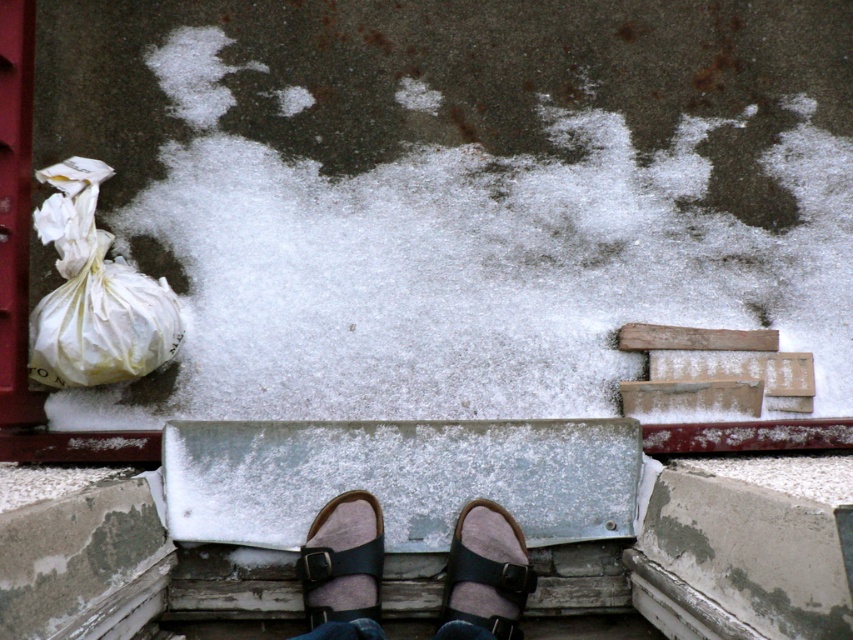
You are standing in the snowy scene and want to place a small object exactly halfway between the two points labeled point [500,586] and point [500,561]. Considering their positions, where would this midpoint be located relative to the viewer?

The midpoint between point [500,586] and point [500,561] would be closer to the viewer than point [500,561] but farther than point [500,586] since point [500,586] is closer to the viewer.

You are a photographer trying to capture the snowy scene. You notice the leather sandals at center and the black leather sandal at center. Which sandal is covering the other one?

The black leather sandal at center is covering the leather sandals at center because the leather sandals at center is positioned under the black leather sandal at center.